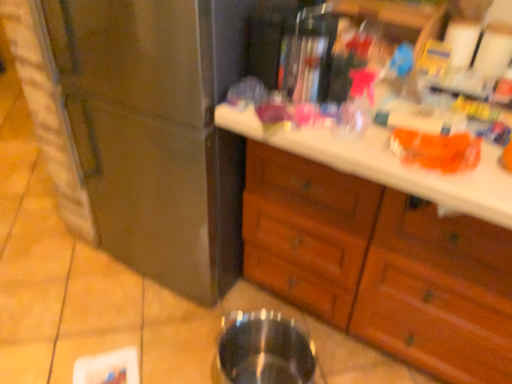
Locate an element on the screen. This screenshot has width=512, height=384. vacant space positioned to the left of transparent glass at lower center is located at coordinates (174, 352).